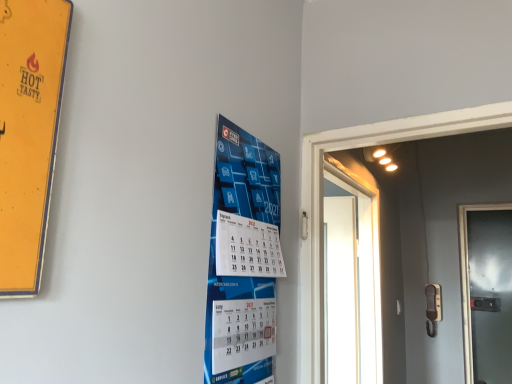
Question: Is point (430, 286) closer or farther from the camera than point (373, 208)?

Choices:
 (A) closer
 (B) farther

Answer: (B)

Question: From the image's perspective, is beige matte door handle at right positioned above or below white glossy door at right, which is the first door in left-to-right order?

Choices:
 (A) below
 (B) above

Answer: (A)

Question: Based on their relative distances, which object is farther from the metallic glass door at right, the 2th door viewed from the front?

Choices:
 (A) white glossy door at right, the 1th door positioned from the front
 (B) blue paper calendar at center
 (C) beige matte door handle at right

Answer: (B)

Question: Estimate the real-world distances between objects in this image. Which object is farther from the white glossy door at right, the 1th door positioned from the front?

Choices:
 (A) beige matte door handle at right
 (B) blue paper calendar at center
 (C) metallic glass door at right, which is the 2th door in left-to-right order

Answer: (B)